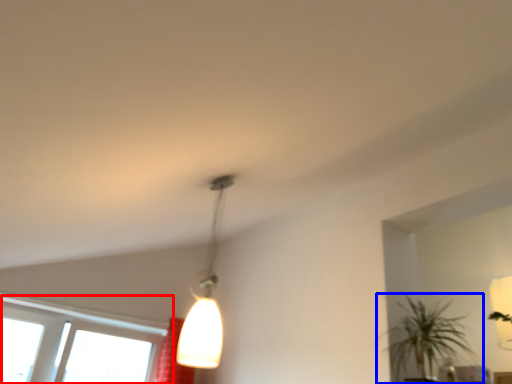
Question: Which object is further to the camera taking this photo, window (highlighted by a red box) or houseplant (highlighted by a blue box)?

Choices:
 (A) window
 (B) houseplant

Answer: (A)